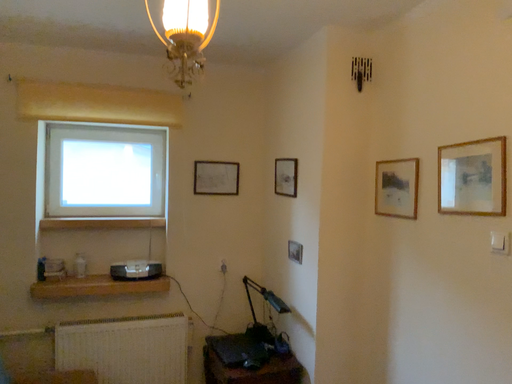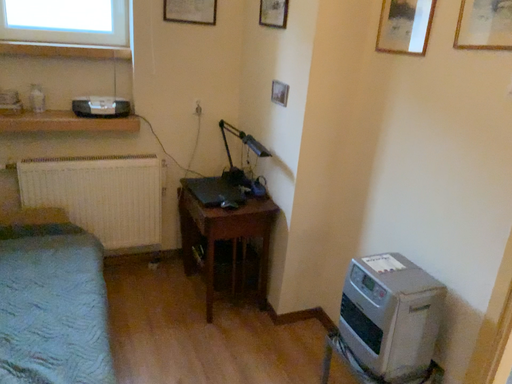
Question: How did the camera likely rotate when shooting the video?

Choices:
 (A) rotated upward
 (B) rotated downward

Answer: (B)